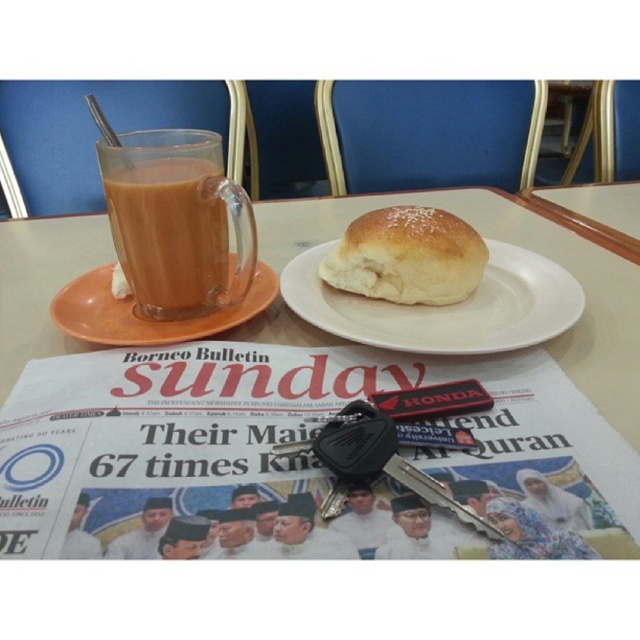
You are a person with a 12 inch long arm. You want to reach the white matte plate at center from your current position. Can you reach it?

The white matte plate at center is 14.43 inches away from the viewer. Since your arm is only 12 inches long, you cannot reach it.

Based on the photo, you are setting up a small plate on the table. The golden brown bread at center is already placed. Can the white glossy table at center accommodate another small plate next to the existing one?

The white glossy table at center has a larger size compared to golden brown bread at center, so yes, there is enough space to place another small plate next to the existing one.

You are a person sitting at the white glossy table at center. You want to reach for the golden brown bread at center. Can you easily grab it without moving your body?

The white glossy table at center is in front of golden brown bread at center, so the bread is positioned in front of you and can be easily reached without moving your body.